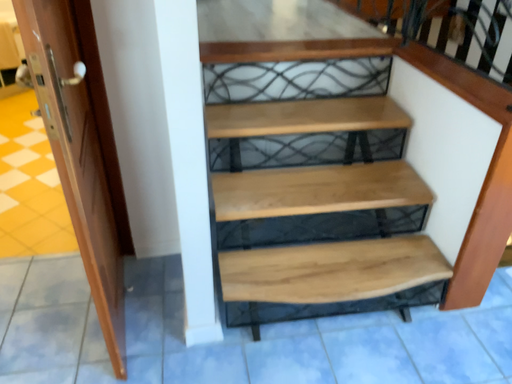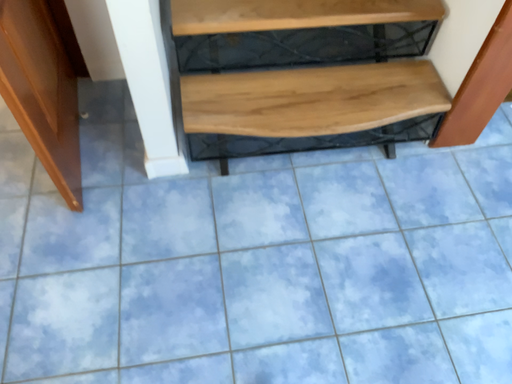
Question: How did the camera likely rotate when shooting the video?

Choices:
 (A) rotated upward
 (B) rotated downward

Answer: (B)